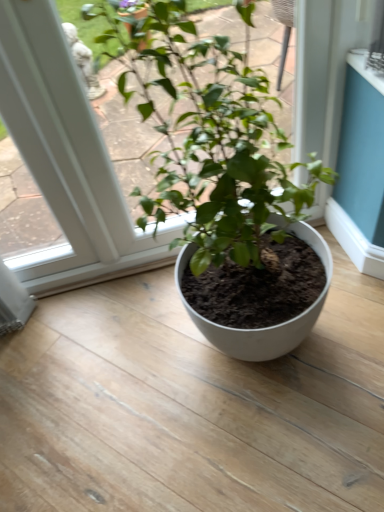
Image resolution: width=384 pixels, height=512 pixels. Find the location of `vacant space in front of matte white pot at center`. vacant space in front of matte white pot at center is located at coordinates (275, 442).